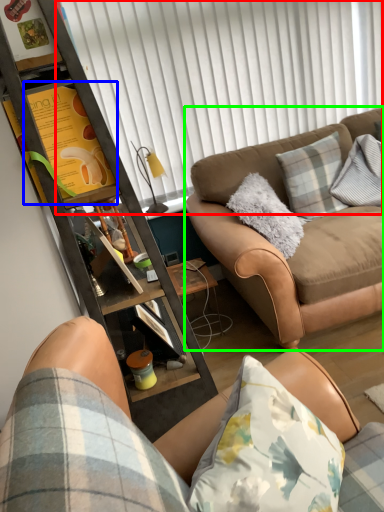
Question: Based on their relative distances, which object is nearer to shutter (highlighted by a red box)? Choose from bulletin board (highlighted by a blue box) and studio couch (highlighted by a green box).

Choices:
 (A) bulletin board
 (B) studio couch

Answer: (B)